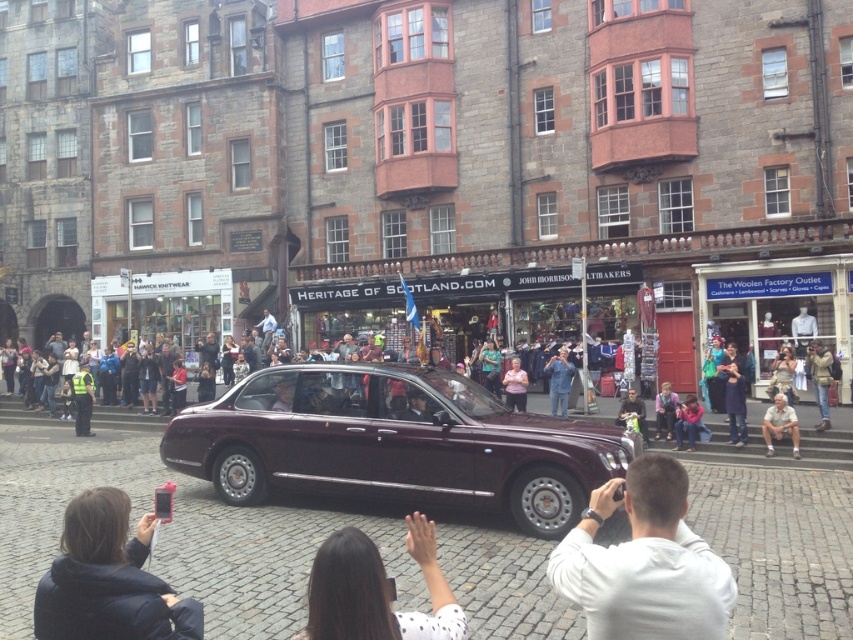
Does dark blue jacket at lower left appear under green fabric bag at center?

Actually, dark blue jacket at lower left is above green fabric bag at center.

Measure the distance between point (143, 632) and camera.

Point (143, 632) and camera are 9.66 meters apart from each other.

Does point (51, 600) lie in front of point (624, 400)?

Yes.

This screenshot has width=853, height=640. In order to click on dark blue jacket at lower left in this screenshot , I will do `click(108, 579)`.

How far apart are denim jacket at lower right and tan fabric pants at lower right?

denim jacket at lower right and tan fabric pants at lower right are 4.85 meters apart.

From the picture: Can you confirm if denim jacket at lower right is positioned to the left of tan fabric pants at lower right?

No, denim jacket at lower right is not to the left of tan fabric pants at lower right.

Identify the location of denim jacket at lower right. (821, 378).

Is white matte shirt at center below pink fabric at center?

No, white matte shirt at center is not below pink fabric at center.

Who is more forward, (651, 483) or (517, 381)?

Point (651, 483) is more forward.

I want to click on white matte shirt at center, so click(x=643, y=563).